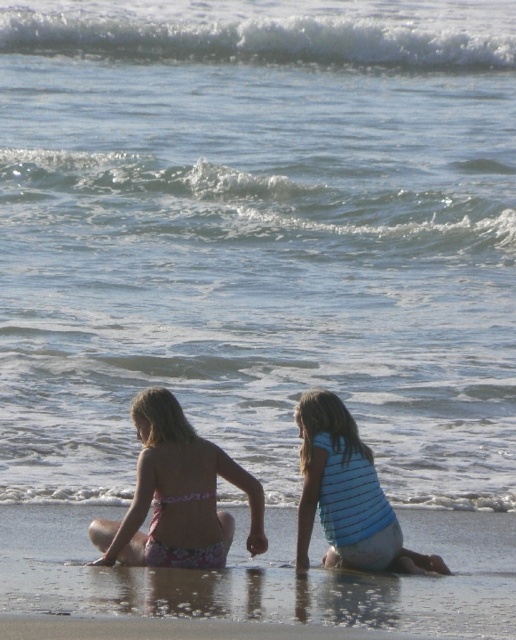
Can you confirm if smooth sand at lower center is shorter than pink floral swimsuit at lower left?

Yes.

Is point (454, 609) positioned in front of point (198, 492)?

Yes, it is.

Image resolution: width=516 pixels, height=640 pixels. In order to click on smooth sand at lower center in this screenshot , I will do pyautogui.click(x=268, y=576).

Which is behind, point (478, 609) or point (359, 488)?

Point (359, 488)

Can you confirm if smooth sand at lower center is positioned to the right of blue striped shirt at lower center?

Yes, smooth sand at lower center is to the right of blue striped shirt at lower center.

Image resolution: width=516 pixels, height=640 pixels. Identify the location of smooth sand at lower center. (268, 576).

Does pink floral swimsuit at lower left have a lesser height compared to blue striped shirt at lower center?

Indeed, pink floral swimsuit at lower left has a lesser height compared to blue striped shirt at lower center.

Is point (116, 522) farther from camera compared to point (326, 506)?

That is False.

Between point (215, 528) and point (335, 515), which one is positioned behind?

The point (335, 515) is behind.

This screenshot has width=516, height=640. In order to click on pink floral swimsuit at lower left in this screenshot , I will do `click(176, 496)`.